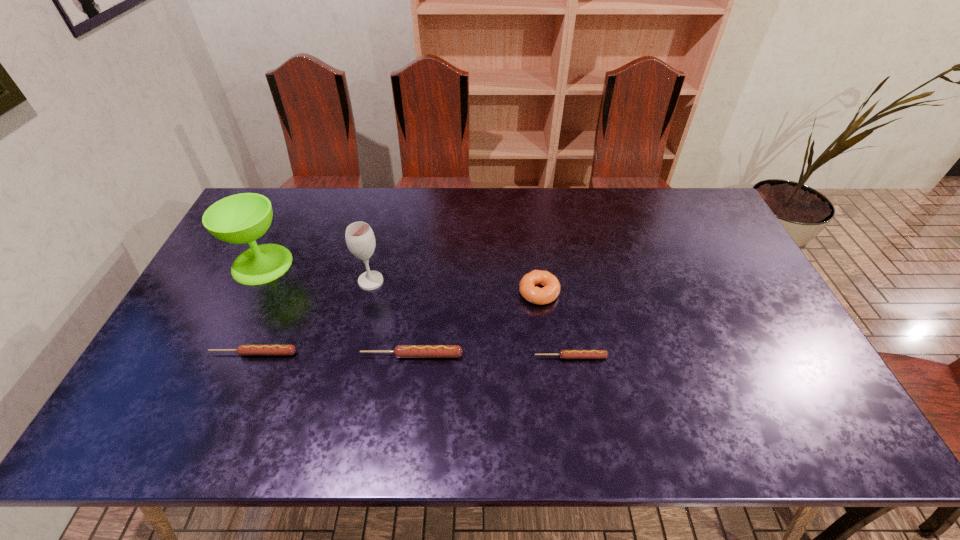
Find the location of a particular element. the leftmost sausage is located at coordinates (x=241, y=349).

Where is `the second tallest sausage`? the second tallest sausage is located at coordinates (241, 349).

This screenshot has width=960, height=540. I want to click on the second sausage from left to right, so click(401, 351).

This screenshot has width=960, height=540. I want to click on the shortest object, so click(564, 354).

The height and width of the screenshot is (540, 960). In order to click on the shortest sausage in this screenshot , I will do `click(564, 354)`.

You are a GUI agent. You are given a task and a screenshot of the screen. Output one action in this format:
    pyautogui.click(x=<x>, y=<y>)
    Task: Click on the doughnut
    The height and width of the screenshot is (540, 960).
    Given the screenshot: What is the action you would take?
    pyautogui.click(x=540, y=296)

Where is `the left wineglass`? This screenshot has width=960, height=540. the left wineglass is located at coordinates (242, 218).

Locate an element on the screen. Image resolution: width=960 pixels, height=540 pixels. the right wineglass is located at coordinates (360, 239).

What are the coordinates of `vacant area located on the right of the leftmost sausage` in the screenshot? It's located at (444, 353).

Locate an element on the screen. The height and width of the screenshot is (540, 960). free space located on the back of the second sausage from right to left is located at coordinates (421, 276).